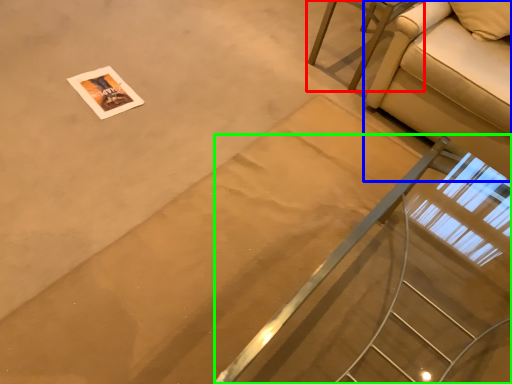
Question: Considering the real-world distances, which object is farthest from furniture (highlighted by a red box)? studio couch (highlighted by a blue box) or stairs (highlighted by a green box)?

Choices:
 (A) studio couch
 (B) stairs

Answer: (B)